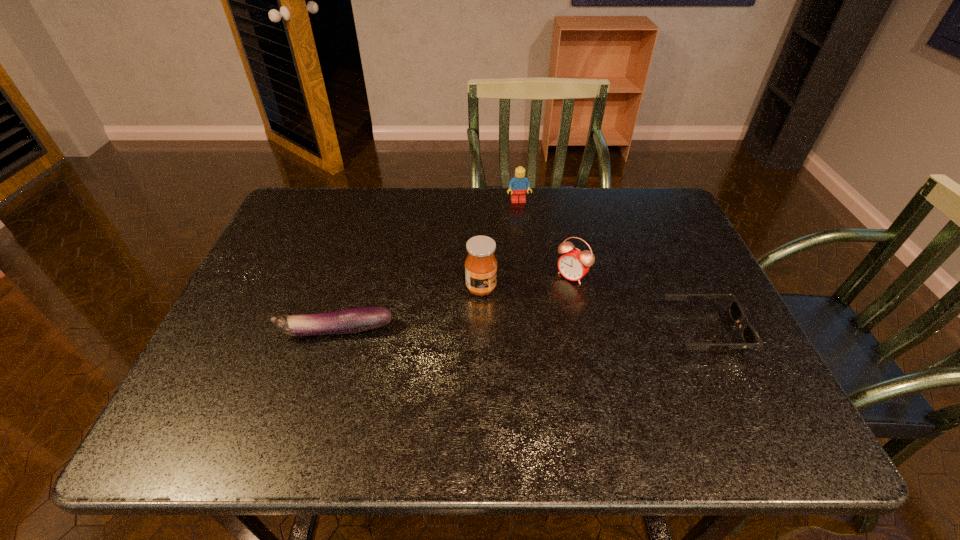
Find the location of a particular element. vacant region between the rightmost object and the second shortest object is located at coordinates (520, 331).

Where is `free space between the honey and the shortest object`? Image resolution: width=960 pixels, height=540 pixels. free space between the honey and the shortest object is located at coordinates (593, 309).

Locate an element on the screen. This screenshot has height=540, width=960. vacant region between the rightmost object and the second object from right to left is located at coordinates (638, 303).

The width and height of the screenshot is (960, 540). I want to click on unoccupied position between the second object from right to left and the shortest object, so click(x=638, y=303).

Identify the location of vacant point located between the leftmost object and the Lego. (427, 266).

Where is `vacant space in between the eggplant and the alarm clock`? The height and width of the screenshot is (540, 960). vacant space in between the eggplant and the alarm clock is located at coordinates (454, 303).

This screenshot has width=960, height=540. Find the location of `vacant space in between the tallest object and the shortest object`. vacant space in between the tallest object and the shortest object is located at coordinates (593, 309).

The width and height of the screenshot is (960, 540). Identify the location of object that is the second closest one to the second shortest object. (574, 264).

This screenshot has height=540, width=960. I want to click on object that ranks as the second closest to the farthest object, so click(480, 264).

Identify the location of free spot that satisfies the following two spatial constraints: 1. on the front side of the alarm clock; 2. on the temples of the sunglasses. pyautogui.click(x=584, y=331).